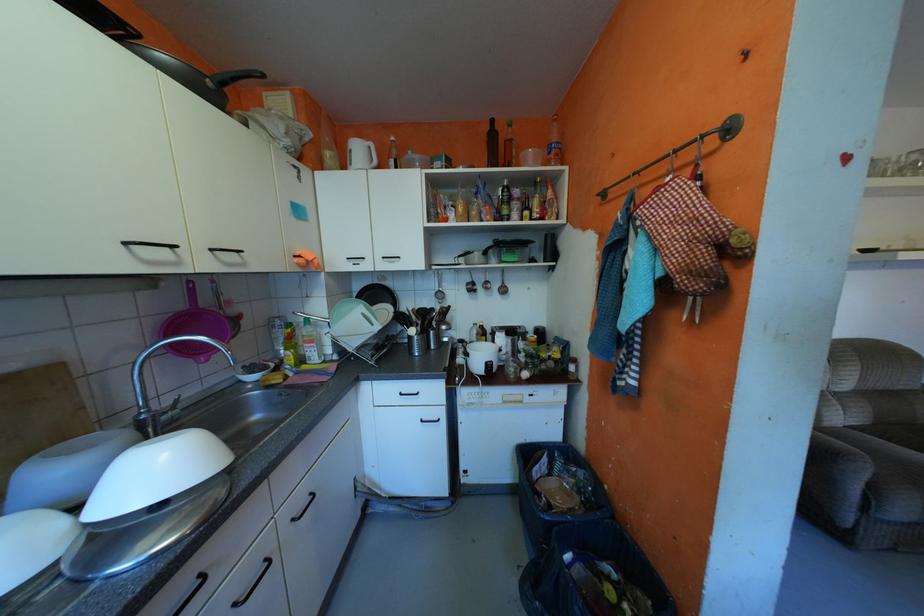
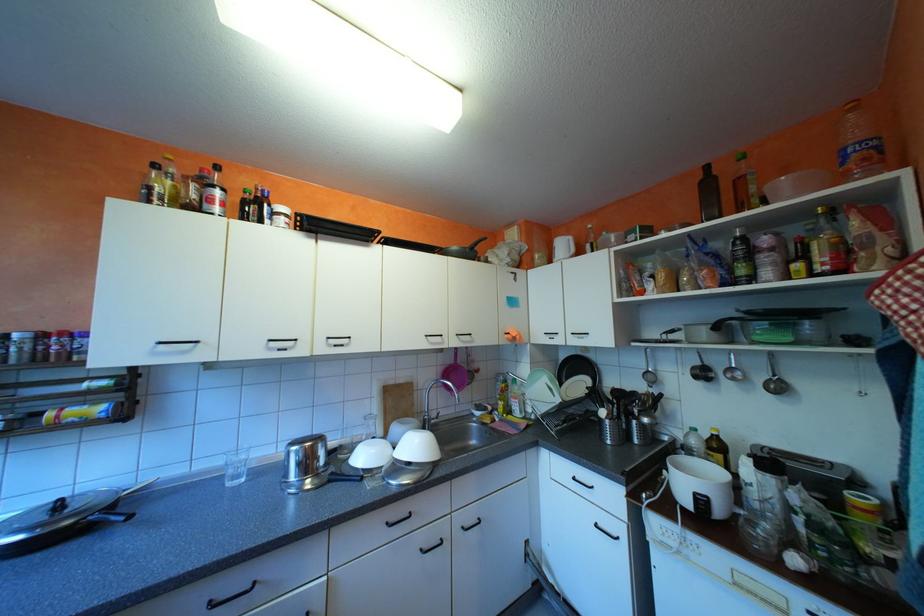
Where in the second image is the point corresponding to the point at 305,519 from the first image?

(475, 527)